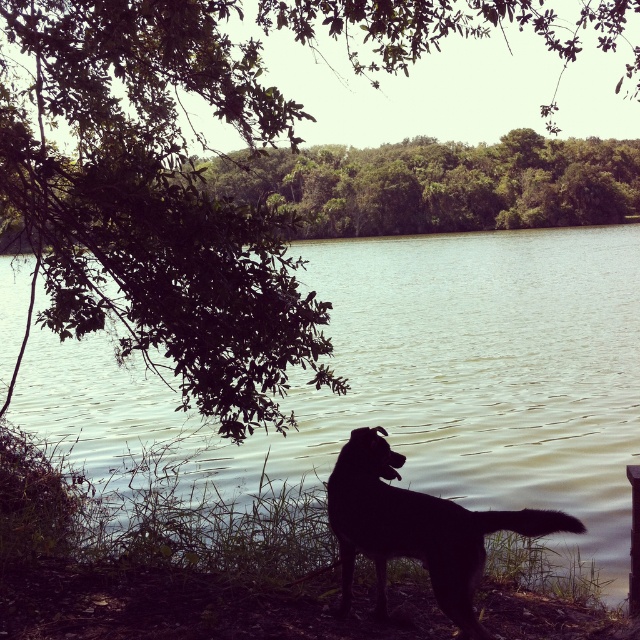
Question: Is smooth water at center positioned before green leafy tree at upper left?

Choices:
 (A) no
 (B) yes

Answer: (B)

Question: Which of the following is the farthest from the observer?

Choices:
 (A) (304, 252)
 (B) (140, 84)
 (C) (461, 545)

Answer: (A)

Question: Which object is farther from the camera taking this photo?

Choices:
 (A) smooth water at center
 (B) black fur dog at lower center
 (C) green leafy tree at upper left

Answer: (C)

Question: Considering the relative positions of smooth water at center and black fur dog at lower center in the image provided, where is smooth water at center located with respect to black fur dog at lower center?

Choices:
 (A) right
 (B) left

Answer: (B)

Question: Where is green leafy tree at upper left located in relation to black fur dog at lower center in the image?

Choices:
 (A) right
 (B) left

Answer: (B)

Question: Estimate the real-world distances between objects in this image. Which object is farther from the green leafy tree at upper left?

Choices:
 (A) smooth water at center
 (B) black fur dog at lower center

Answer: (B)